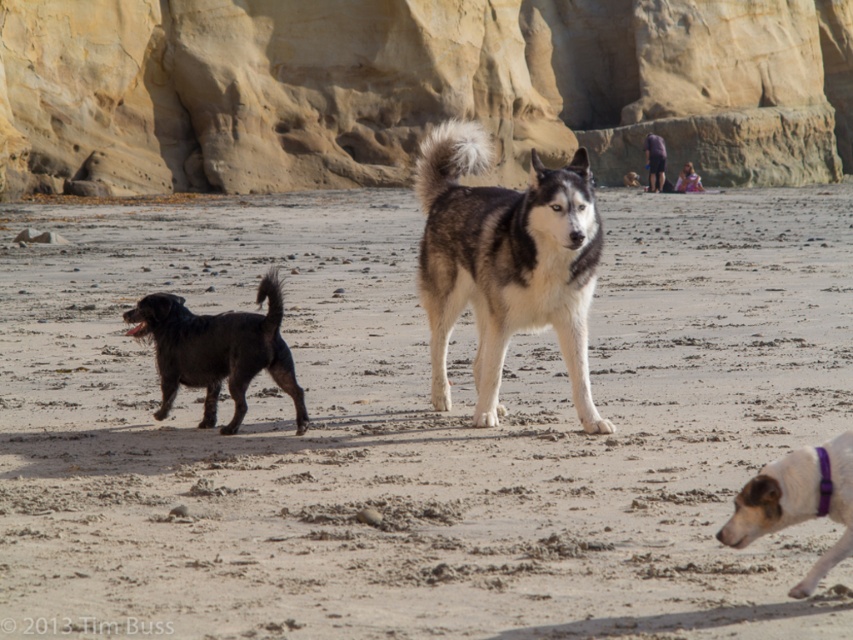
Question: Which point is closer to the camera?

Choices:
 (A) black fur dog at left
 (B) white fur dog at lower right
 (C) sandy beach at center

Answer: (C)

Question: Considering the real-world distances, which object is farthest from the black fur dog at left?

Choices:
 (A) smooth sandstone cliff at upper center
 (B) white fur husky at center
 (C) sandy beach at center

Answer: (A)

Question: Is smooth sandstone cliff at upper center to the left of black fur dog at left from the viewer's perspective?

Choices:
 (A) no
 (B) yes

Answer: (A)

Question: Is white fur husky at center to the right of black fur dog at left from the viewer's perspective?

Choices:
 (A) yes
 (B) no

Answer: (A)

Question: Which object appears farthest from the camera in this image?

Choices:
 (A) sandy beach at center
 (B) white fur husky at center

Answer: (B)

Question: Does smooth sandstone cliff at upper center appear on the right side of white fur dog at lower right?

Choices:
 (A) yes
 (B) no

Answer: (A)